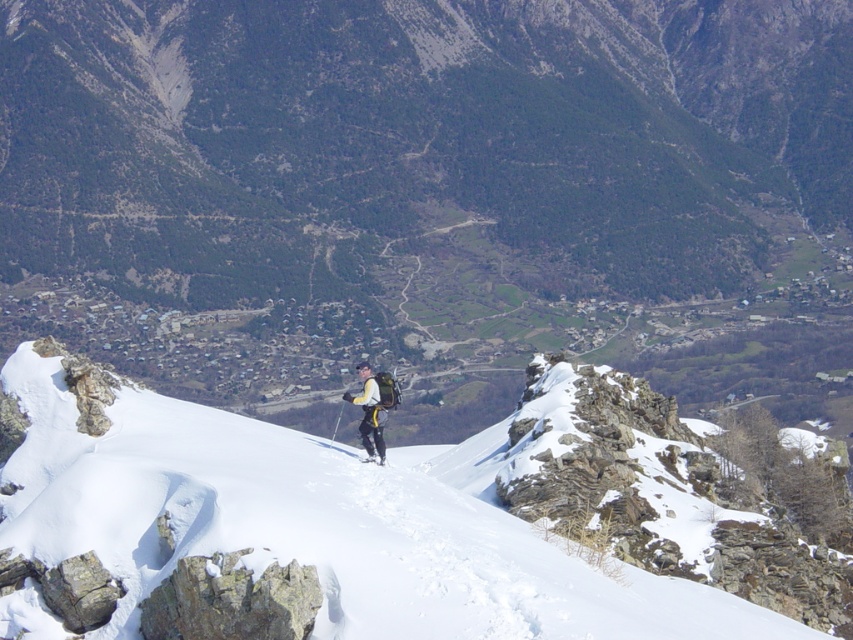
Locate an element on the screen. The height and width of the screenshot is (640, 853). white powdery snow at center is located at coordinates (384, 522).

Identify the location of white powdery snow at center. (384, 522).